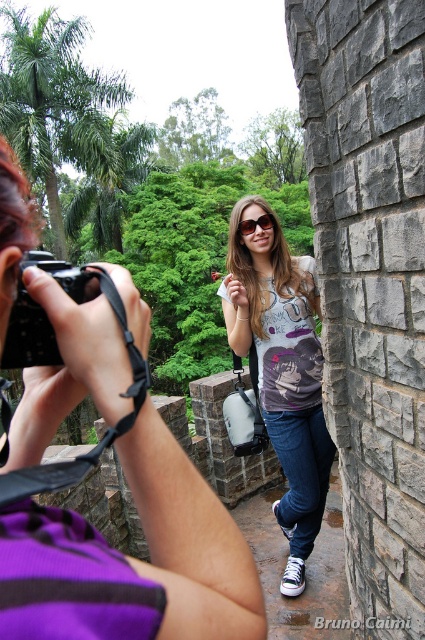
Does black plastic camera at left have a lesser height compared to matte plastic goggles at center?

Incorrect, black plastic camera at left's height does not fall short of matte plastic goggles at center's.

Where is `black plastic camera at left`? The height and width of the screenshot is (640, 425). black plastic camera at left is located at coordinates (44, 310).

Is matte purple shirt at center to the right of black plastic camera at left from the viewer's perspective?

Yes, matte purple shirt at center is to the right of black plastic camera at left.

What do you see at coordinates (133, 497) in the screenshot? I see `matte purple shirt at center` at bounding box center [133, 497].

Is point (17, 433) positioned in front of point (19, 333)?

No, (17, 433) is behind (19, 333).

In order to click on matte purple shirt at center in this screenshot , I will do coord(133,497).

Who is lower down, matte gray t-shirt at center or matte plastic goggles at center?

Positioned lower is matte gray t-shirt at center.

Is matte gray t-shirt at center thinner than matte plastic goggles at center?

In fact, matte gray t-shirt at center might be wider than matte plastic goggles at center.

Between point (303, 298) and point (252, 227), which one is positioned in front?

Positioned in front is point (303, 298).

Locate an element on the screen. This screenshot has height=640, width=425. matte gray t-shirt at center is located at coordinates (282, 371).